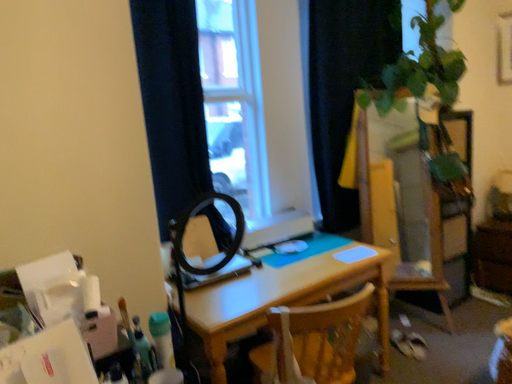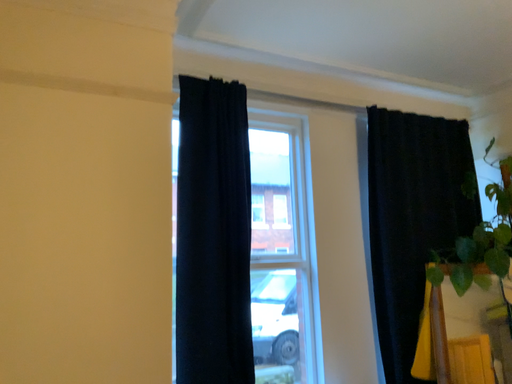
Question: Which way did the camera rotate in the video?

Choices:
 (A) rotated left
 (B) rotated right

Answer: (A)